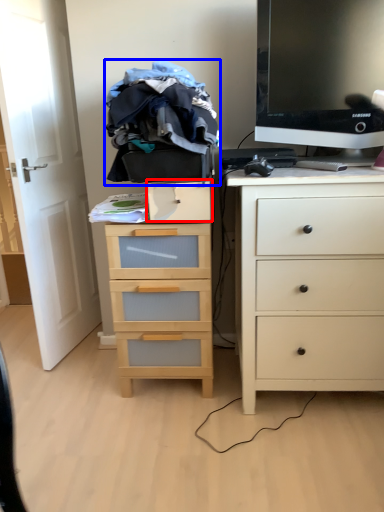
Question: Which object appears closest to the camera in this image, drawer (highlighted by a red box) or clothing (highlighted by a blue box)?

Choices:
 (A) drawer
 (B) clothing

Answer: (B)